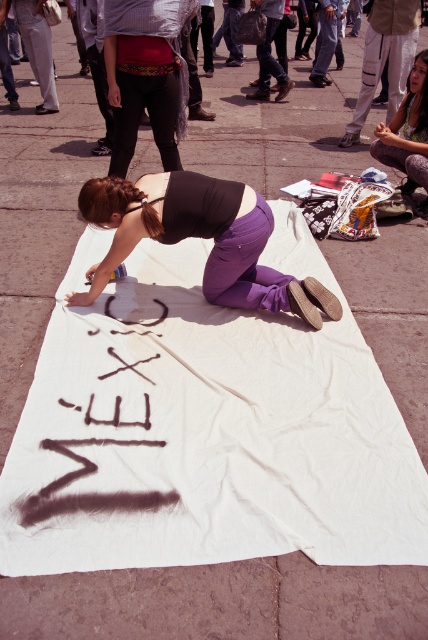
Does white fabric at center appear under purple cotton pants at center?

Yes, white fabric at center is below purple cotton pants at center.

Can you confirm if white fabric at center is shorter than purple cotton pants at center?

Incorrect, white fabric at center's height does not fall short of purple cotton pants at center's.

I want to click on white fabric at center, so (205, 428).

Is white fabric at center above matte red shirt at center?

Incorrect, white fabric at center is not positioned above matte red shirt at center.

Between white fabric at center and matte red shirt at center, which one appears on the right side from the viewer's perspective?

white fabric at center is more to the right.

You are a GUI agent. You are given a task and a screenshot of the screen. Output one action in this format:
    pyautogui.click(x=<x>, y=<y>)
    Task: Click on the white fabric at center
    
    Given the screenshot: What is the action you would take?
    pyautogui.click(x=205, y=428)

This screenshot has width=428, height=640. In order to click on white fabric at center in this screenshot , I will do `click(205, 428)`.

Does white fabric at center have a smaller size compared to matte brown hair at lower right?

Incorrect, white fabric at center is not smaller in size than matte brown hair at lower right.

Describe the element at coordinates (205, 428) in the screenshot. I see `white fabric at center` at that location.

Locate an element on the screen. The height and width of the screenshot is (640, 428). white fabric at center is located at coordinates (205, 428).